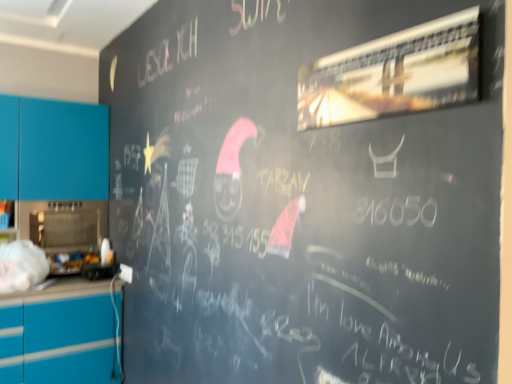
What do you see at coordinates (53, 150) in the screenshot?
I see `teal matte cabinet at left` at bounding box center [53, 150].

In order to click on teal matte cabinet at left in this screenshot , I will do `click(53, 150)`.

Locate an element on the screen. metallic reflective sign at upper right is located at coordinates (394, 74).

Image resolution: width=512 pixels, height=384 pixels. What do you see at coordinates (394, 74) in the screenshot? I see `metallic reflective sign at upper right` at bounding box center [394, 74].

You are a GUI agent. You are given a task and a screenshot of the screen. Output one action in this format:
    pyautogui.click(x=<x>, y=<y>)
    Task: Click on the teal matte cabinet at left
    
    Given the screenshot: What is the action you would take?
    pyautogui.click(x=53, y=150)

From the picture: Does metallic reflective sign at upper right appear on the left side of teal matte cabinet at left?

No, metallic reflective sign at upper right is not to the left of teal matte cabinet at left.

Considering the positions of objects metallic reflective sign at upper right and teal matte cabinet at left in the image provided, who is behind, metallic reflective sign at upper right or teal matte cabinet at left?

teal matte cabinet at left is further away from the camera.

Which point is more forward, (364,72) or (1,135)?

Point (364,72)

From the image's perspective, which is below, metallic reflective sign at upper right or teal matte cabinet at left?

teal matte cabinet at left is shown below in the image.

From a real-world perspective, is metallic reflective sign at upper right physically above teal matte cabinet at left?

Yes, from a real-world perspective, metallic reflective sign at upper right is above teal matte cabinet at left.

Can you confirm if metallic reflective sign at upper right is wider than teal matte cabinet at left?

No, metallic reflective sign at upper right is not wider than teal matte cabinet at left.

Considering the sizes of objects metallic reflective sign at upper right and teal matte cabinet at left in the image provided, who is taller, metallic reflective sign at upper right or teal matte cabinet at left?

With more height is teal matte cabinet at left.

Considering the relative sizes of metallic reflective sign at upper right and teal matte cabinet at left in the image provided, is metallic reflective sign at upper right smaller than teal matte cabinet at left?

Yes, metallic reflective sign at upper right is smaller than teal matte cabinet at left.

Is teal matte cabinet at left completely or partially inside metallic reflective sign at upper right?

No, teal matte cabinet at left is not surrounded by metallic reflective sign at upper right.

Are metallic reflective sign at upper right and teal matte cabinet at left far apart?

Yes, metallic reflective sign at upper right is far from teal matte cabinet at left.

Is metallic reflective sign at upper right oriented towards teal matte cabinet at left?

No, metallic reflective sign at upper right is not aimed at teal matte cabinet at left.

How distant is metallic reflective sign at upper right from teal matte cabinet at left?

The distance of metallic reflective sign at upper right from teal matte cabinet at left is 2.42 meters.

I want to click on bulletin board in front of the teal matte cabinet at left, so click(394, 74).

Which is more to the left, teal matte cabinet at left or metallic reflective sign at upper right?

teal matte cabinet at left is more to the left.

Which is in front, teal matte cabinet at left or metallic reflective sign at upper right?

metallic reflective sign at upper right is closer to the camera.

Between point (80, 175) and point (429, 77), which one is positioned in front?

The point (429, 77) is closer.

From the image's perspective, is teal matte cabinet at left on top of metallic reflective sign at upper right?

No, from the image's perspective, teal matte cabinet at left is not over metallic reflective sign at upper right.

From the picture: From a real-world perspective, which object rests below the other?

In real-world perspective, teal matte cabinet at left is lower.

Looking at this image, considering the sizes of objects teal matte cabinet at left and metallic reflective sign at upper right in the image provided, who is thinner, teal matte cabinet at left or metallic reflective sign at upper right?

Thinner between the two is metallic reflective sign at upper right.

Is teal matte cabinet at left taller or shorter than metallic reflective sign at upper right?

Clearly, teal matte cabinet at left is taller compared to metallic reflective sign at upper right.

Who is bigger, teal matte cabinet at left or metallic reflective sign at upper right?

Bigger between the two is teal matte cabinet at left.

Can we say teal matte cabinet at left lies outside metallic reflective sign at upper right?

teal matte cabinet at left is positioned outside metallic reflective sign at upper right.

Is teal matte cabinet at left in contact with metallic reflective sign at upper right?

No, teal matte cabinet at left is not making contact with metallic reflective sign at upper right.

Is metallic reflective sign at upper right at the back of teal matte cabinet at left?

No, teal matte cabinet at left is not facing the opposite direction of metallic reflective sign at upper right.

How different are the orientations of teal matte cabinet at left and metallic reflective sign at upper right in degrees?

teal matte cabinet at left and metallic reflective sign at upper right are facing 90.4 degrees away from each other.

How distant is teal matte cabinet at left from metallic reflective sign at upper right?

teal matte cabinet at left and metallic reflective sign at upper right are 7.94 feet apart from each other.

Find the location of a particular element. This screenshot has width=512, height=384. bulletin board above the teal matte cabinet at left (from a real-world perspective) is located at coordinates (394, 74).

The height and width of the screenshot is (384, 512). In order to click on bulletin board above the teal matte cabinet at left (from a real-world perspective) in this screenshot , I will do `click(394, 74)`.

At what (x,y) coordinates should I click in order to perform the action: click on cabinetry that is on the left side of metallic reflective sign at upper right. Please return your answer as a coordinate pair (x, y). Looking at the image, I should click on pos(53,150).